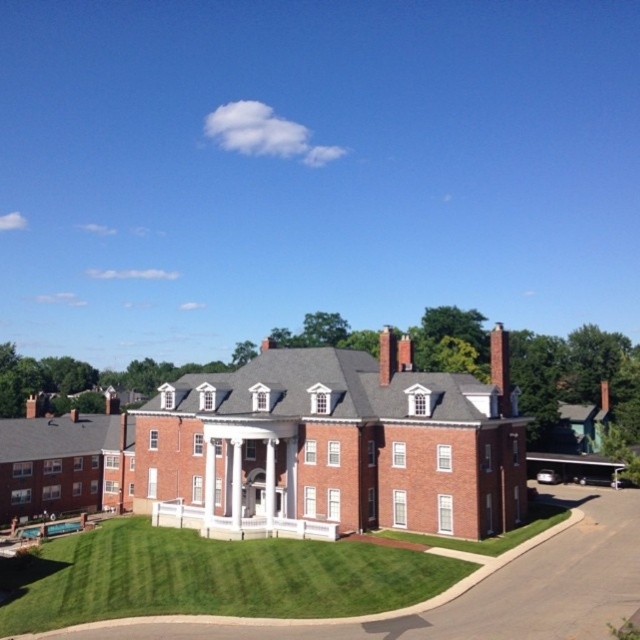
Looking at this image, you are standing on the lawn in front of the brick house at center and the brick mansion at lower left. Which building is closer to you?

The brick house at center is closer to you because it is in front of the brick mansion at lower left.

You are standing in front of the building and want to determine the relative positions of two points marked on the facade. Which point is closer to you, point at coordinates (276, 449) or point at coordinates (490, 364)?

Point at coordinates (276, 449) is closer to the viewer than point at coordinates (490, 364).